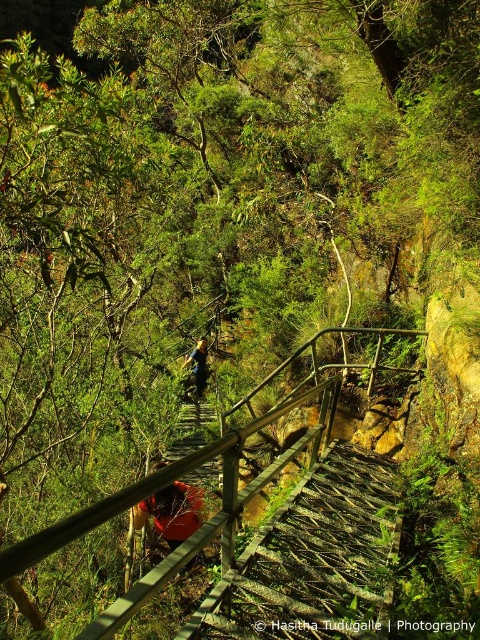
Question: Among these points, which one is nearest to the camera?

Choices:
 (A) (159, 531)
 (B) (190, 358)

Answer: (A)

Question: Is red fabric backpack at center closer to the viewer compared to green fabric backpack at center?

Choices:
 (A) no
 (B) yes

Answer: (B)

Question: Among these objects, which one is nearest to the camera?

Choices:
 (A) green fabric backpack at center
 (B) metal/wooden rail at center
 (C) red fabric backpack at center
 (D) wooden staircase at center

Answer: (D)

Question: Can you confirm if metal/wooden rail at center is positioned to the left of red fabric backpack at center?

Choices:
 (A) no
 (B) yes

Answer: (A)

Question: Estimate the real-world distances between objects in this image. Which object is farther from the wooden staircase at center?

Choices:
 (A) metal/wooden rail at center
 (B) green fabric backpack at center

Answer: (B)

Question: Does wooden staircase at center appear on the right side of metal/wooden rail at center?

Choices:
 (A) no
 (B) yes

Answer: (A)